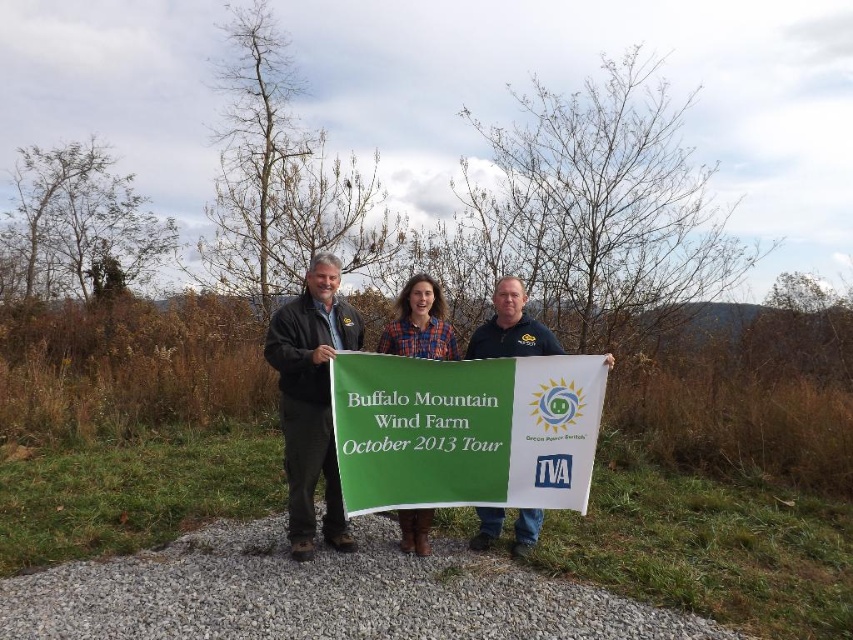
Question: Which point is farther from the camera taking this photo?

Choices:
 (A) (548, 424)
 (B) (560, 353)
 (C) (325, 474)
 (D) (427, 292)

Answer: (C)

Question: Is dark blue shirt at center closer to the viewer compared to plaid fabric shirt at center?

Choices:
 (A) no
 (B) yes

Answer: (A)

Question: Which of the following is the farthest from the observer?

Choices:
 (A) (483, 474)
 (B) (340, 301)
 (C) (503, 314)
 (D) (410, 348)

Answer: (B)

Question: Does dark brown leather jacket at center appear under plaid fabric shirt at center?

Choices:
 (A) yes
 (B) no

Answer: (A)

Question: Does green fabric banner at center appear on the right side of dark blue shirt at center?

Choices:
 (A) no
 (B) yes

Answer: (A)

Question: Which object is positioned farthest from the plaid fabric shirt at center?

Choices:
 (A) dark blue shirt at center
 (B) dark brown leather jacket at center
 (C) green fabric banner at center

Answer: (B)